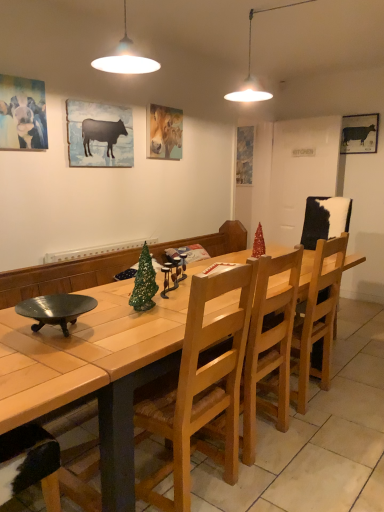
Where is `unoccupied region to the right of light brown wood chair at center, the first chair positioned from the left`? unoccupied region to the right of light brown wood chair at center, the first chair positioned from the left is located at coordinates (277, 477).